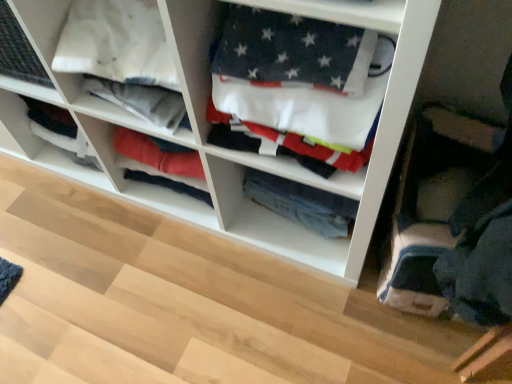
You are a GUI agent. You are given a task and a screenshot of the screen. Output one action in this format:
    pyautogui.click(x=<x>, y=<y>)
    Task: Click on the vacant region in front of denim jeans at center, arranged as the 1th clothing when viewed from the back
    The height and width of the screenshot is (384, 512).
    Given the screenshot: What is the action you would take?
    pyautogui.click(x=316, y=254)